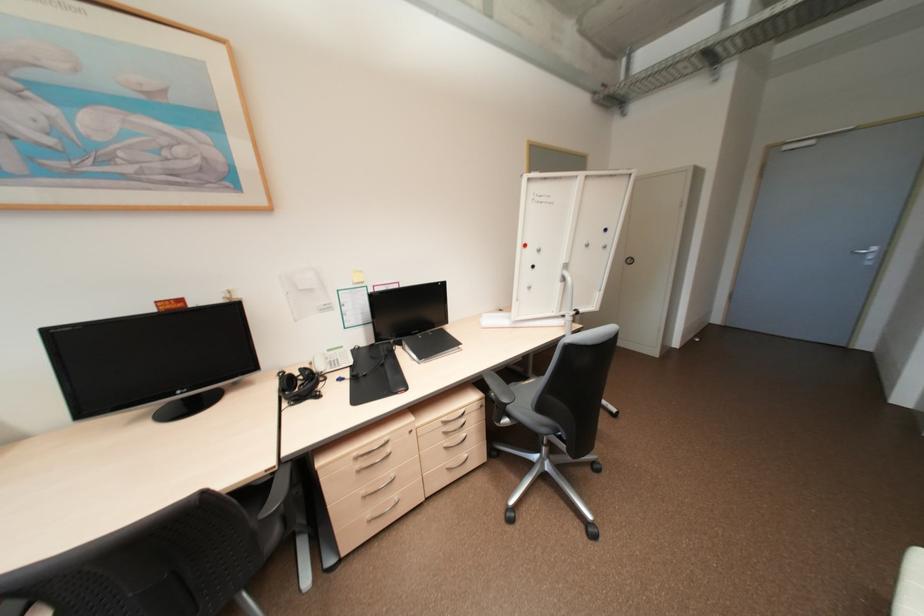
Locate an element on the screen. The height and width of the screenshot is (616, 924). blue whiteboard magnet is located at coordinates (533, 264).